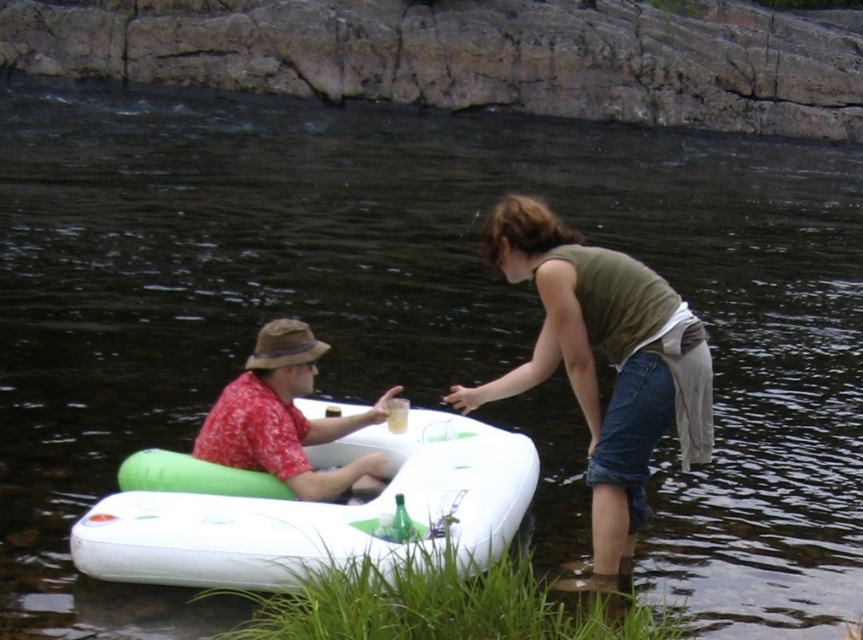
Question: Is green fabric shirt at center to the left of red floral shirt at center from the viewer's perspective?

Choices:
 (A) no
 (B) yes

Answer: (A)

Question: Which point is closer to the camera?

Choices:
 (A) (198, 433)
 (B) (597, 566)

Answer: (B)

Question: Can you confirm if white rubber boat at center is positioned above red floral shirt at center?

Choices:
 (A) no
 (B) yes

Answer: (A)

Question: Does green fabric shirt at center have a smaller size compared to red floral shirt at center?

Choices:
 (A) no
 (B) yes

Answer: (A)

Question: Based on their relative distances, which object is farther from the green fabric shirt at center?

Choices:
 (A) white rubber boat at center
 (B) red floral shirt at center

Answer: (A)

Question: Which object is closer to the camera taking this photo?

Choices:
 (A) white rubber boat at center
 (B) red floral shirt at center
 (C) green fabric shirt at center

Answer: (A)